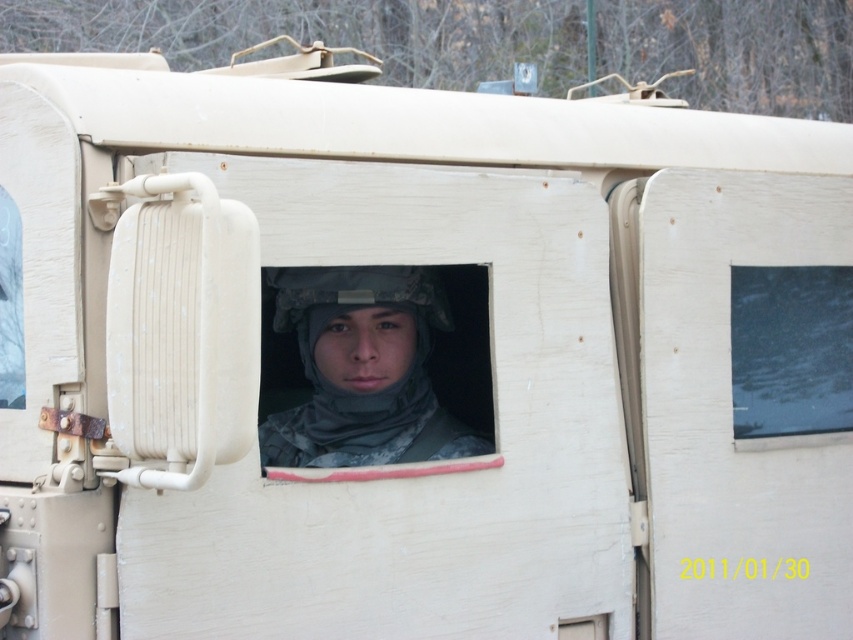
How far apart are camouflage fabric helmet at center and transparent glass window at center?

camouflage fabric helmet at center is 69.47 centimeters away from transparent glass window at center.

Is camouflage fabric helmet at center to the left of transparent glass window at center from the viewer's perspective?

Indeed, camouflage fabric helmet at center is positioned on the left side of transparent glass window at center.

Is point (422, 436) behind point (778, 376)?

Yes.

The height and width of the screenshot is (640, 853). What are the coordinates of `camouflage fabric helmet at center` in the screenshot? It's located at (363, 369).